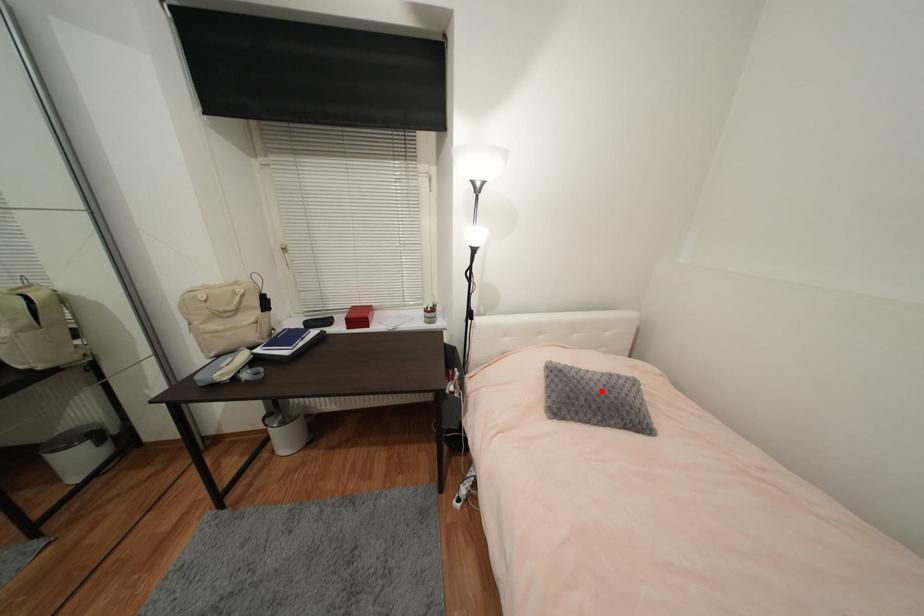
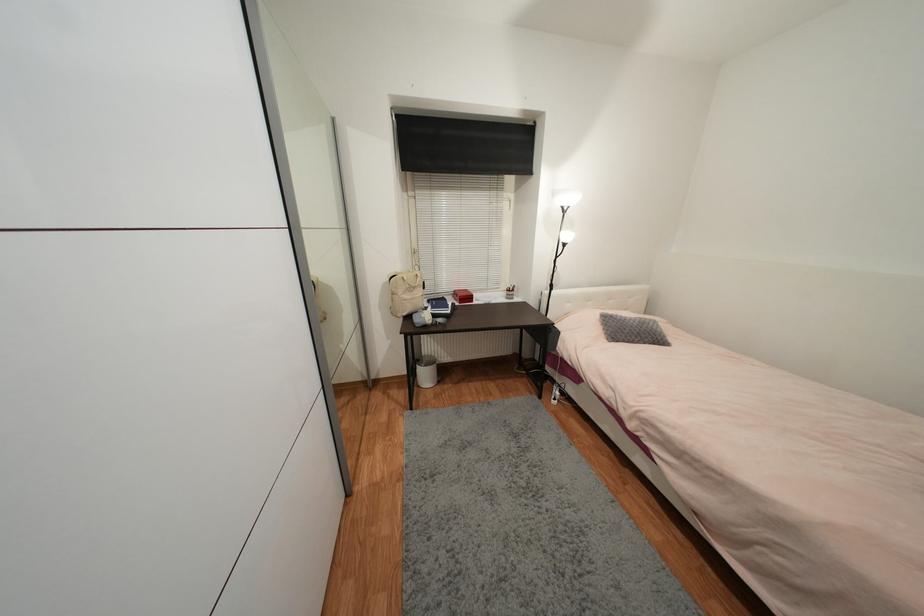
Find the pixel in the second image that matches the highlighted location in the first image.

(639, 326)